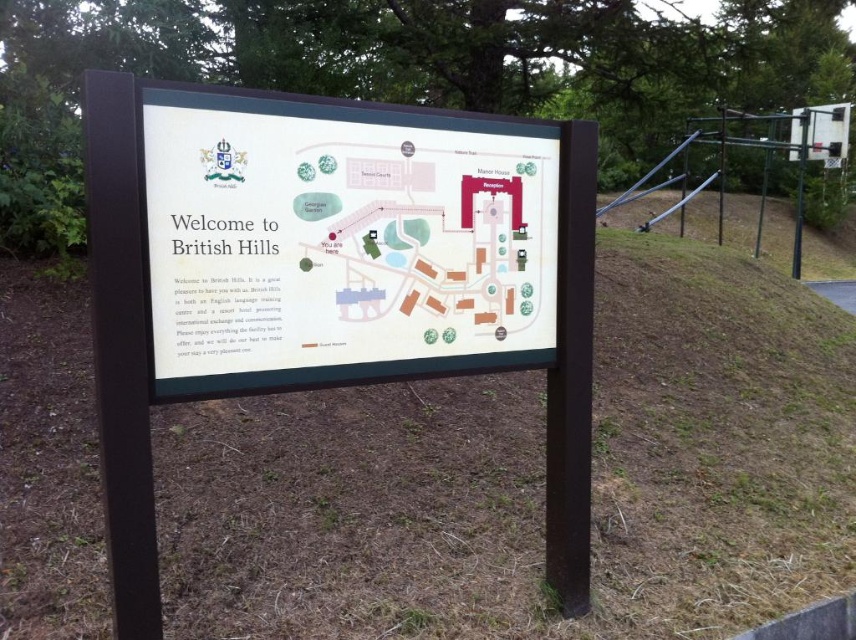
You are standing in front of the British Hills signboard and need to locate two points marked on the map. The first point is at coordinates point (450,157) and the second at point (125,109). Which point is closer to the viewer?

Point (125,109) is closer to the viewer because the description states that point (450,157) is behind it.